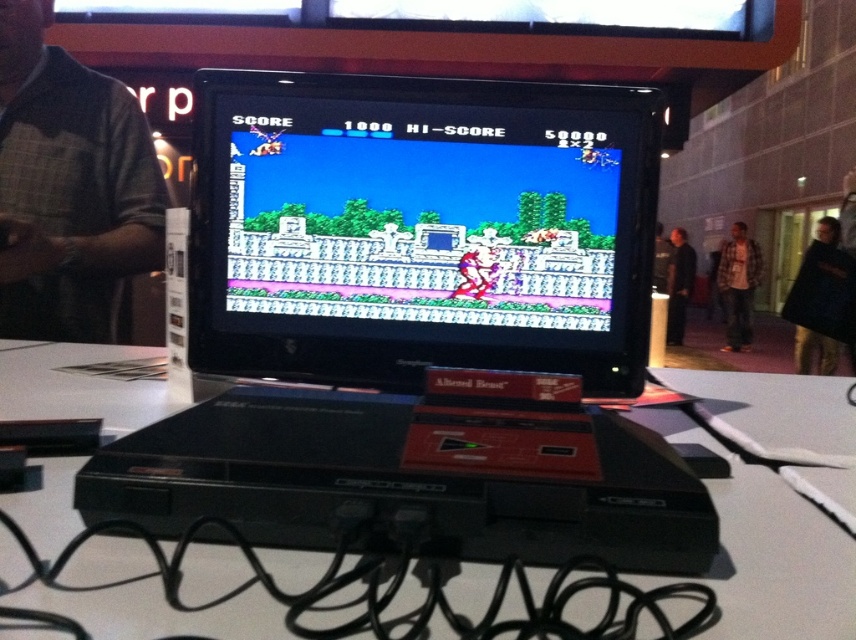
Question: Which of the following is the closest to the observer?

Choices:
 (A) (146, 227)
 (B) (829, 236)
 (C) (217, 163)
 (D) (45, 460)

Answer: (D)

Question: Which point appears farthest from the camera in this image?

Choices:
 (A) pos(800,368)
 (B) pos(770,529)
 (C) pos(140,264)
 (D) pos(684,298)

Answer: (D)

Question: Is white glossy table at center smaller than black fabric at right?

Choices:
 (A) no
 (B) yes

Answer: (A)

Question: Does black plastic computer at center have a greater width compared to plaid flannel shirt at center?

Choices:
 (A) yes
 (B) no

Answer: (B)

Question: Does pixelated screen at center appear over black leather jacket at right?

Choices:
 (A) yes
 (B) no

Answer: (B)

Question: Which of the following is the farthest from the observer?

Choices:
 (A) black plastic computer at center
 (B) black leather jacket at right
 (C) white glossy table at center
 (D) brown checkered shirt at left

Answer: (B)